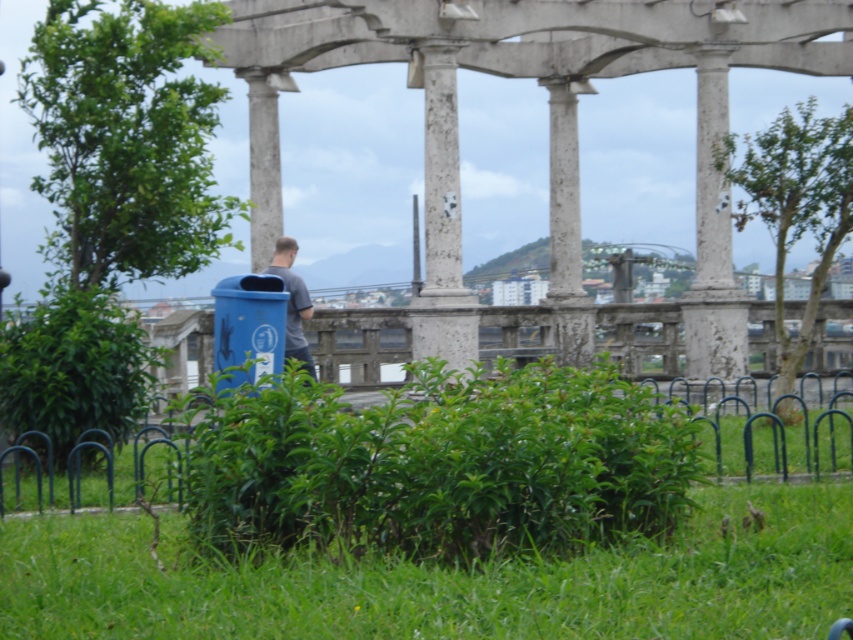
Where is `green leafy grass at lower center`? green leafy grass at lower center is located at coordinates (444, 580).

Between green leafy grass at lower center and white stone column at center, which one appears on the right side from the viewer's perspective?

green leafy grass at lower center

Is point (132, 602) farther from viewer compared to point (422, 337)?

No, it is not.

Where is `green leafy grass at lower center`? green leafy grass at lower center is located at coordinates (444, 580).

Is white stone column at center smaller than gray matte shirt at center?

Yes.

Who is shorter, white stone column at center or gray matte shirt at center?

white stone column at center is shorter.

Where is `white stone column at center`? white stone column at center is located at coordinates (442, 221).

Which is more to the right, green leafy grass at lower center or gray matte shirt at center?

From the viewer's perspective, green leafy grass at lower center appears more on the right side.

Does green leafy grass at lower center appear on the left side of gray matte shirt at center?

In fact, green leafy grass at lower center is to the right of gray matte shirt at center.

Is point (461, 600) positioned after point (276, 269)?

No, (461, 600) is closer to viewer.

Where is `green leafy grass at lower center`? The image size is (853, 640). green leafy grass at lower center is located at coordinates (444, 580).